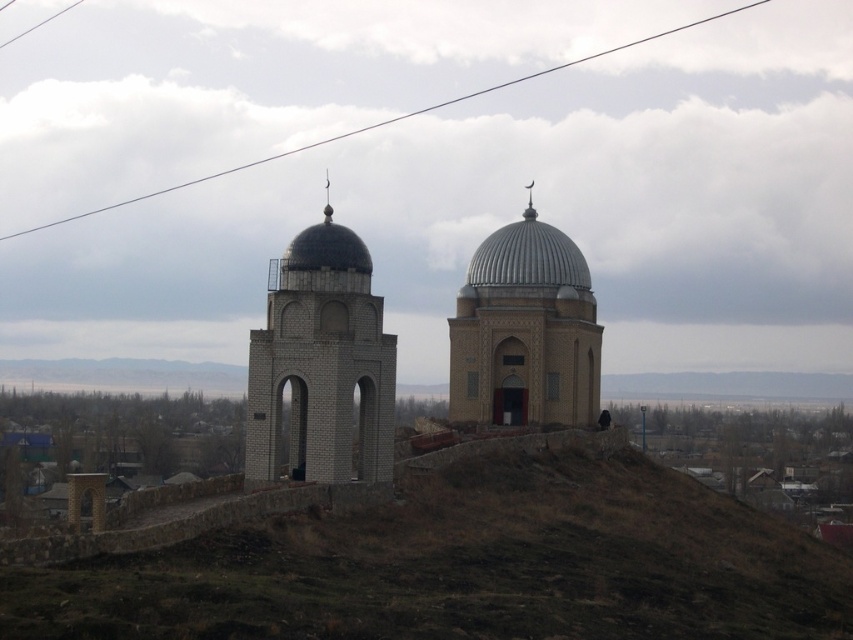
Can you confirm if metallic ribbed dome at center is thinner than black wire at upper center?

Correct, metallic ribbed dome at center's width is less than black wire at upper center's.

Is point (509, 266) positioned behind point (83, 214)?

That is False.

Where is `metallic ribbed dome at center`? metallic ribbed dome at center is located at coordinates (527, 257).

Can you confirm if metallic ribbed dome at center is shorter than matte white dome at center?

No.

Which is behind, point (585, 268) or point (322, 221)?

Positioned behind is point (585, 268).

Measure the distance between metallic ribbed dome at center and camera.

metallic ribbed dome at center and camera are 139.90 meters apart from each other.

Identify the location of metallic ribbed dome at center. (527, 257).

Can you confirm if brown grassy hillside at center is wider than black wire at upper center?

Incorrect, brown grassy hillside at center's width does not surpass black wire at upper center's.

Is brown grassy hillside at center taller than black wire at upper center?

Incorrect, brown grassy hillside at center's height is not larger of black wire at upper center's.

Where is `brown grassy hillside at center`? The width and height of the screenshot is (853, 640). brown grassy hillside at center is located at coordinates (467, 566).